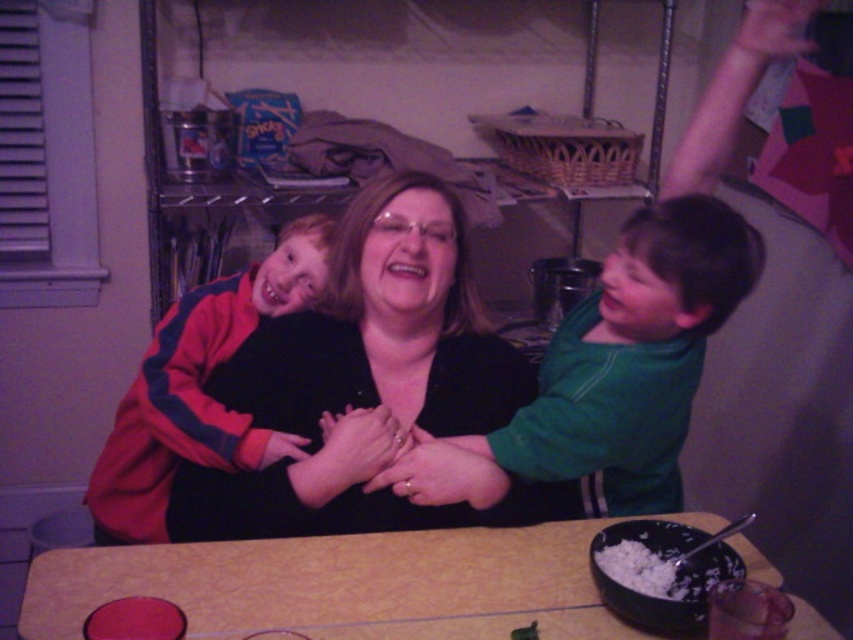
You are a chef preparing a meal and need to place the white matte rice bowl at lower center on the yellow textured table at center. Considering their sizes, will the bowl fit on the table?

The yellow textured table at center has a greater height compared to white matte rice bowl at lower center, so the bowl will fit on the table since it is shorter than the table.

You are planning to place a rectangular plate that is 10 inches wide on the yellow textured table at center. The white matte rice bowl at lower center is already on the table. Can the plate fit on the table without overlapping the bowl?

The yellow textured table at center is wider than the white matte rice bowl at lower center, so the plate can fit on the table as long as it is placed in an area not occupied by the bowl.

Looking at this image, you are planning to place a rectangular tray that is 1.2 meters long on the yellow textured table at center. Considering the table size relative to the red fleece jacket at left, can the tray fit on the table?

The yellow textured table at center is wider than the red fleece jacket at left, but without knowing the exact dimensions of the table, it is impossible to determine if the 1.2 meter tray will fit. The description only states the table is wider than the jacket, not its actual size.